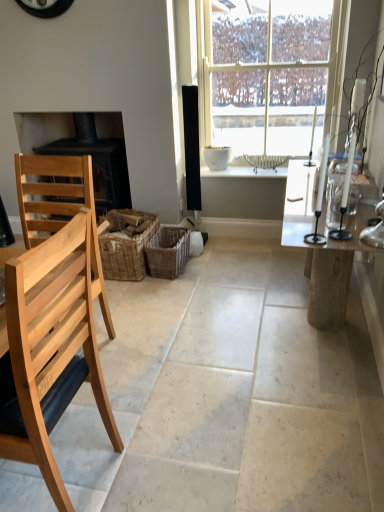
Question: Looking at the image, does black matte fireplace at left seem bigger or smaller compared to woven brown basket at center, arranged as the 2th crate when viewed from the left?

Choices:
 (A) small
 (B) big

Answer: (B)

Question: Would you say black matte fireplace at left is inside or outside woven brown basket at center, the 1th crate positioned from the right?

Choices:
 (A) inside
 (B) outside

Answer: (B)

Question: Based on their relative distances, which object is farther from the woven brown basket at center, which appears as the 2th crate when viewed from the right?

Choices:
 (A) white wicker basket at center
 (B) clear glass table at right
 (C) natural wood chair at left, placed as the first chair when sorted from back to front
 (D) woven brown basket at center, arranged as the 2th crate when viewed from the left
 (E) white glass window at center

Answer: (E)

Question: Estimate the real-world distances between objects in this image. Which object is closer to the natural wood chair at left, arranged as the 2th chair when viewed from the front?

Choices:
 (A) woven brown basket at center, the 1th crate positioned from the right
 (B) white wicker basket at center
 (C) clear glass table at right
 (D) white glass window at center
 (E) natural wood chair at left, the first chair when ordered from front to back

Answer: (E)